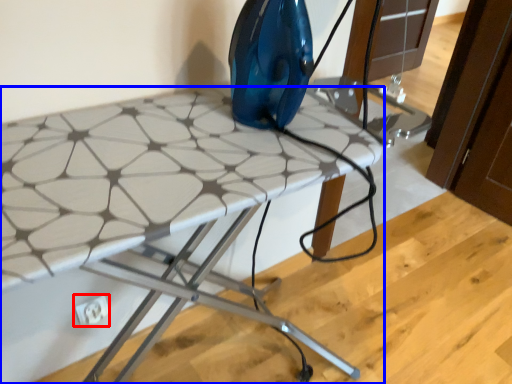
Question: Which of the following is the farthest to the observer, electric outlet (highlighted by a red box) or table (highlighted by a blue box)?

Choices:
 (A) electric outlet
 (B) table

Answer: (A)